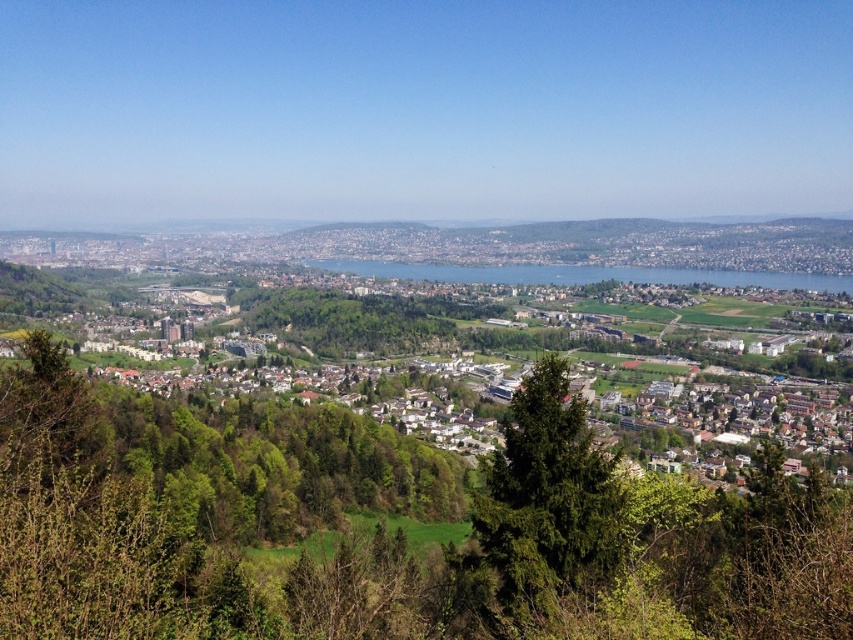
Question: Which object is closer to the camera taking this photo?

Choices:
 (A) green leafy tree at center
 (B) blue water at center
 (C) green grassy town at center

Answer: (A)

Question: Does green grassy town at center appear over green leafy tree at center?

Choices:
 (A) no
 (B) yes

Answer: (B)

Question: Which of the following is the farthest from the observer?

Choices:
 (A) green leafy tree at center
 (B) green grassy town at center
 (C) blue water at center

Answer: (C)

Question: Does green leafy tree at center come behind blue water at center?

Choices:
 (A) yes
 (B) no

Answer: (B)

Question: Can you confirm if green grassy town at center is thinner than blue water at center?

Choices:
 (A) yes
 (B) no

Answer: (B)

Question: Which point is closer to the camera?

Choices:
 (A) blue water at center
 (B) green leafy tree at center

Answer: (B)